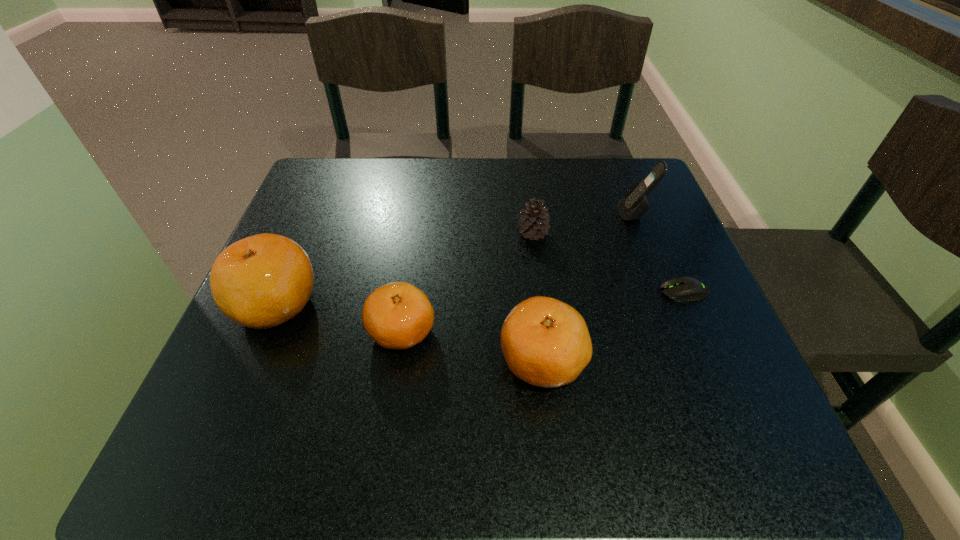
At what (x,y) coordinates should I click in order to perform the action: click on free space at the far right corner. Please return your answer as a coordinate pair (x, y). The image size is (960, 540). Looking at the image, I should click on (612, 203).

The image size is (960, 540). I want to click on vacant space at the near right corner, so click(x=657, y=379).

Locate an element on the screen. free space that is in between the shortest object and the third tallest object is located at coordinates (612, 327).

Where is `free space between the leftmost clementine and the shortest object`? This screenshot has height=540, width=960. free space between the leftmost clementine and the shortest object is located at coordinates (480, 299).

Locate an element on the screen. vacant space in between the cellular telephone and the computer mouse is located at coordinates (660, 253).

Locate an element on the screen. The image size is (960, 540). vacant area between the leftmost object and the shortest object is located at coordinates (480, 299).

Where is `empty space between the cellular telephone and the rightmost clementine`? empty space between the cellular telephone and the rightmost clementine is located at coordinates 588,287.

Locate an element on the screen. The width and height of the screenshot is (960, 540). unoccupied area between the shortest object and the pinecone is located at coordinates (608, 262).

This screenshot has height=540, width=960. Find the location of `free space between the cellular telephone and the second tallest clementine`. free space between the cellular telephone and the second tallest clementine is located at coordinates (588, 287).

Image resolution: width=960 pixels, height=540 pixels. Identify the location of free area in between the leftmost object and the shortest object. (480, 299).